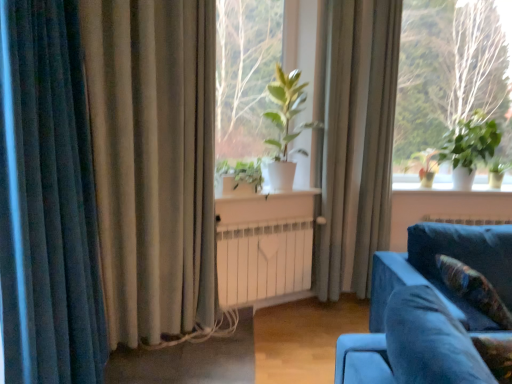
Question: Is green leafy plant at upper right turned away from green matte plant at center, the second plant in the right-to-left sequence?

Choices:
 (A) yes
 (B) no

Answer: (B)

Question: From a real-world perspective, is green leafy plant at upper right on top of green matte plant at center, which ranks as the 1th plant in left-to-right order?

Choices:
 (A) no
 (B) yes

Answer: (B)

Question: From a real-world perspective, is green leafy plant at upper right beneath green matte plant at center, the second plant positioned from the back?

Choices:
 (A) no
 (B) yes

Answer: (A)

Question: Is green leafy plant at upper right placed right next to green matte plant at center, which ranks as the 1th plant in left-to-right order?

Choices:
 (A) no
 (B) yes

Answer: (A)

Question: Does green leafy plant at upper right have a lesser height compared to green matte plant at center, the second plant in the right-to-left sequence?

Choices:
 (A) no
 (B) yes

Answer: (A)

Question: Is point (508, 190) closer or farther from the camera than point (348, 251)?

Choices:
 (A) farther
 (B) closer

Answer: (B)

Question: Based on their positions, is white plastic window sill at right located to the left or right of silky beige curtain at center, the 1th curtain viewed from the back?

Choices:
 (A) right
 (B) left

Answer: (A)

Question: From a real-world perspective, is white plastic window sill at right physically located above or below silky beige curtain at center, the third curtain when ordered from left to right?

Choices:
 (A) below
 (B) above

Answer: (A)

Question: From the image's perspective, is white plastic window sill at right above or below silky beige curtain at center, which is the 1th curtain from right to left?

Choices:
 (A) below
 (B) above

Answer: (A)

Question: Considering the positions of velvet floral pillow at lower right and green leafy plant at upper right in the image, is velvet floral pillow at lower right bigger or smaller than green leafy plant at upper right?

Choices:
 (A) small
 (B) big

Answer: (A)

Question: Looking at their shapes, would you say velvet floral pillow at lower right is wider or thinner than green leafy plant at upper right?

Choices:
 (A) wide
 (B) thin

Answer: (A)

Question: Choose the correct answer: Is velvet floral pillow at lower right inside green leafy plant at upper right or outside it?

Choices:
 (A) outside
 (B) inside

Answer: (A)

Question: Is velvet floral pillow at lower right to the left or to the right of green leafy plant at upper right in the image?

Choices:
 (A) left
 (B) right

Answer: (A)

Question: From the image's perspective, is velvet floral pillow at lower right located above or below green leafy plant at center?

Choices:
 (A) below
 (B) above

Answer: (A)

Question: Considering the positions of velvet floral pillow at lower right and green leafy plant at center in the image, is velvet floral pillow at lower right bigger or smaller than green leafy plant at center?

Choices:
 (A) small
 (B) big

Answer: (A)